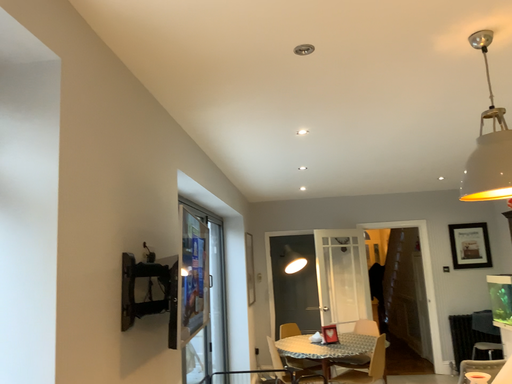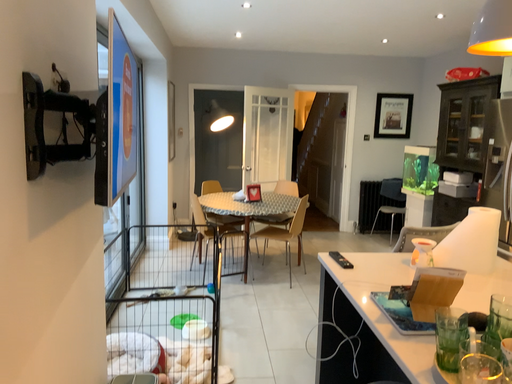
Question: How did the camera likely rotate when shooting the video?

Choices:
 (A) rotated left
 (B) rotated right

Answer: (B)